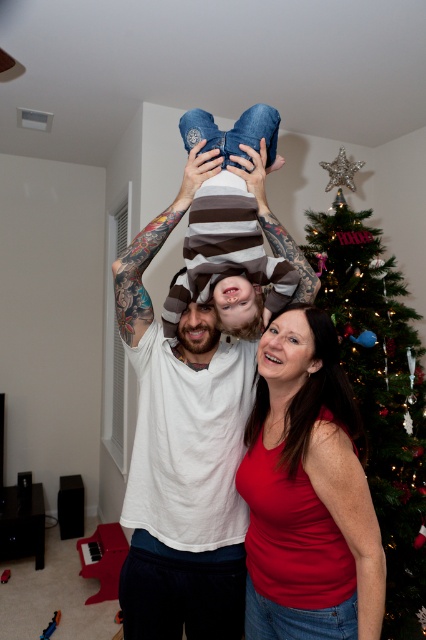
Question: Which object is farther from the camera taking this photo?

Choices:
 (A) denim jeans at center
 (B) matte red shirt at lower center

Answer: (A)

Question: Does white matte shirt at center come behind denim jeans at center?

Choices:
 (A) no
 (B) yes

Answer: (B)

Question: Which object is positioned closest to the denim jeans at center?

Choices:
 (A) white matte shirt at center
 (B) matte red shirt at lower center
 (C) matte red tank top at center

Answer: (A)

Question: Considering the relative positions of green glittery christmas tree at upper right and matte red shirt at lower center in the image provided, where is green glittery christmas tree at upper right located with respect to matte red shirt at lower center?

Choices:
 (A) above
 (B) below

Answer: (B)

Question: Which object appears closest to the camera in this image?

Choices:
 (A) denim jeans at center
 (B) matte red tank top at center
 (C) striped fabric head at center

Answer: (B)

Question: Can you confirm if white matte shirt at center is positioned to the left of striped fabric head at center?

Choices:
 (A) yes
 (B) no

Answer: (B)